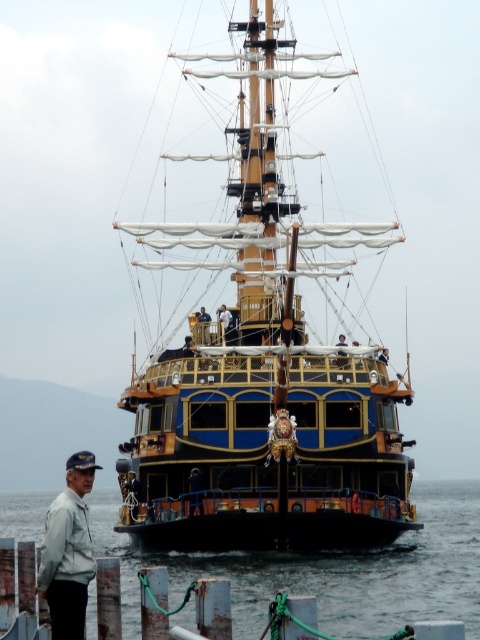
Locate an element on the screen. This screenshot has width=480, height=640. wooden polished ship at center is located at coordinates (264, 390).

Does point (260, 99) come behind point (63, 532)?

Yes, point (260, 99) is behind point (63, 532).

Locate an element on the screen. The height and width of the screenshot is (640, 480). wooden polished ship at center is located at coordinates (264, 390).

Who is taller, transparent water at lower center or white matte jacket at lower left?

white matte jacket at lower left

Between point (24, 508) and point (85, 515), which one is positioned behind?

Positioned behind is point (24, 508).

Find the location of a particular element. This screenshot has width=480, height=640. transparent water at lower center is located at coordinates (328, 570).

Who is positioned more to the right, wooden polished ship at center or transparent water at lower center?

transparent water at lower center

Which is in front, point (217, 346) or point (424, 568)?

Positioned in front is point (217, 346).

Where is `wooden polished ship at center`? The image size is (480, 640). wooden polished ship at center is located at coordinates (264, 390).